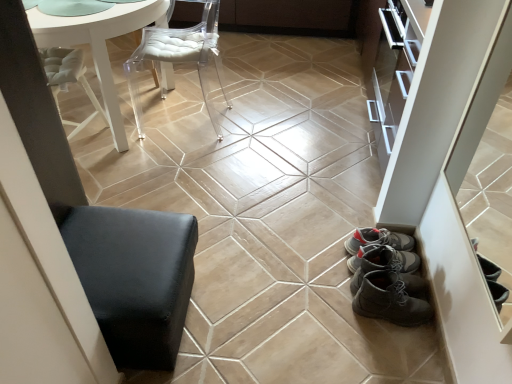
The image size is (512, 384). Identify the location of vacant area that lies to the right of transparent acrylic chair at upper center. (267, 127).